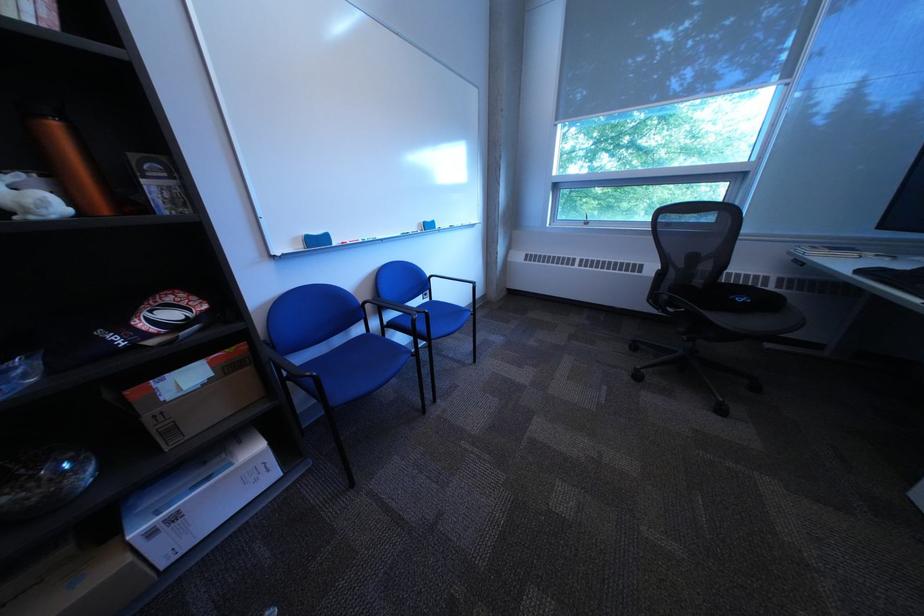
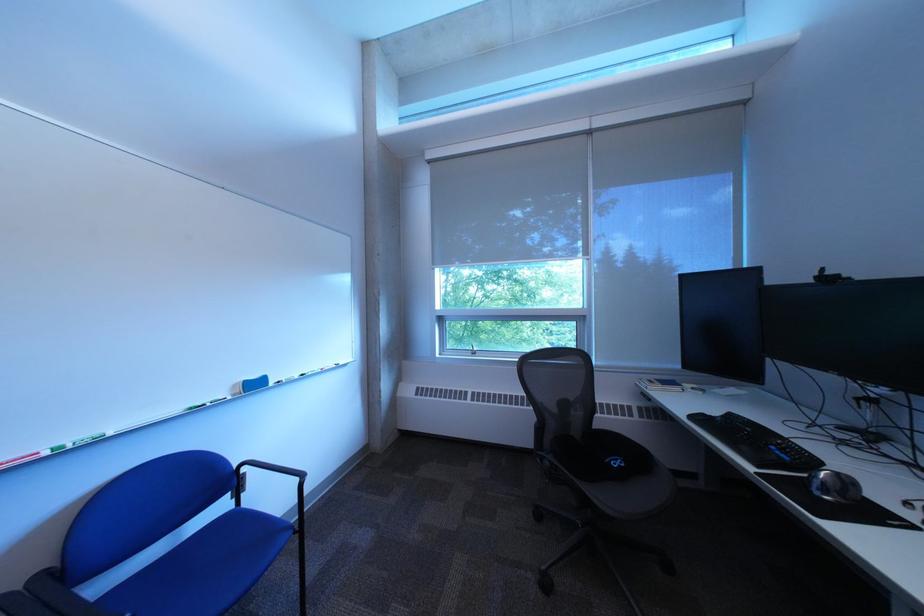
The first image is from the beginning of the video and the second image is from the end. How did the camera likely rotate when shooting the video?

The camera's rotation is toward right-up.